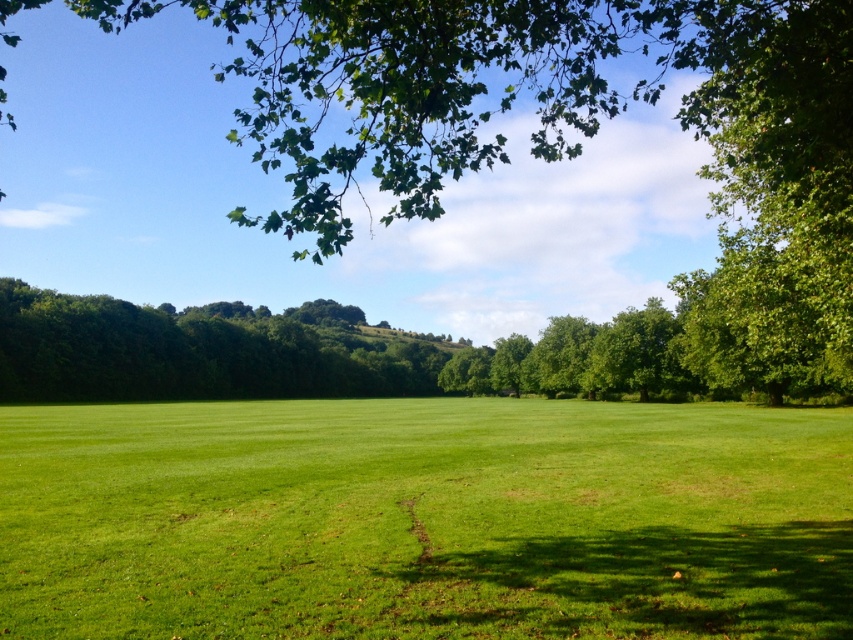
You are standing in the middle of the field and see the green grass at center and the green leafy tree at upper center. Which object is closer to you?

The green grass at center is closer to you because it is in front of the green leafy tree at upper center.

You are a gardener planning to mow the green grass at center and trim the green leafy tree at upper center. Which area requires a wider working space?

The green leafy tree at upper center requires a wider working space because it has a greater width than the green grass at center.